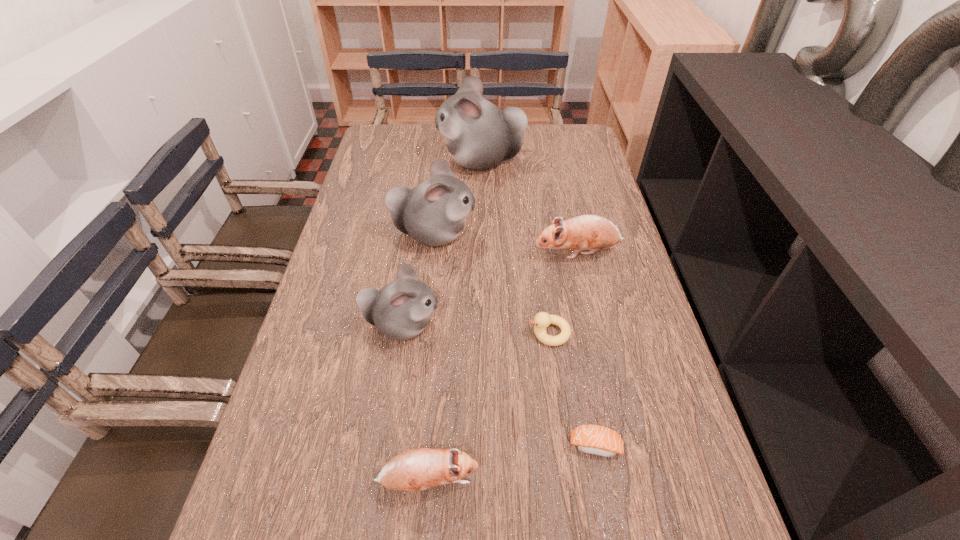
Identify the location of the farthest white hamster. (x=479, y=135).

Image resolution: width=960 pixels, height=540 pixels. In order to click on the farthest object in this screenshot , I will do `click(479, 135)`.

This screenshot has height=540, width=960. Find the location of `the second farthest white hamster`. the second farthest white hamster is located at coordinates (433, 213).

This screenshot has height=540, width=960. In order to click on the sixth shortest object in this screenshot , I will do `click(433, 213)`.

Locate an element on the screen. This screenshot has height=540, width=960. the third tallest object is located at coordinates (400, 310).

Find the location of a particular element. The height and width of the screenshot is (540, 960). the fourth farthest hamster is located at coordinates (x=400, y=310).

You are a GUI agent. You are given a task and a screenshot of the screen. Output one action in this format:
    pyautogui.click(x=<x>, y=<y>)
    Task: Click on the bigger brown hamster
    
    Given the screenshot: What is the action you would take?
    pyautogui.click(x=586, y=232)

This screenshot has width=960, height=540. In order to click on the fourth shortest object in this screenshot , I will do `click(586, 232)`.

Identify the location of the nearer brown hamster. coord(417,469).

Where is `the left brown hamster`? The height and width of the screenshot is (540, 960). the left brown hamster is located at coordinates (417, 469).